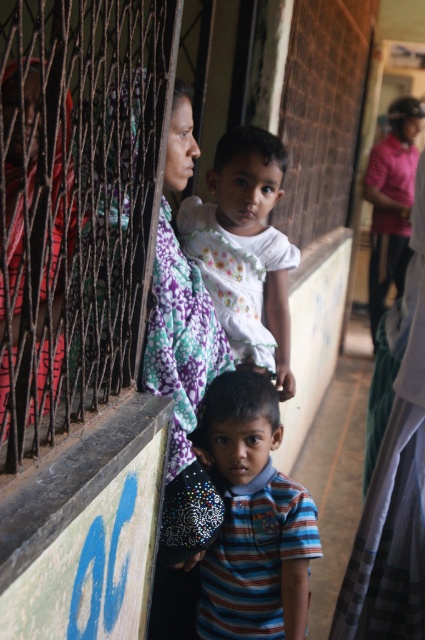
Does striped cotton shirt at center appear on the right side of white matte dress at center?

Indeed, striped cotton shirt at center is positioned on the right side of white matte dress at center.

Can you confirm if striped cotton shirt at center is positioned below white matte dress at center?

Indeed, striped cotton shirt at center is positioned under white matte dress at center.

Find the location of `striped cotton shirt at center`. striped cotton shirt at center is located at coordinates (252, 518).

You are a GUI agent. You are given a task and a screenshot of the screen. Output one action in this format:
    pyautogui.click(x=<x>, y=<y>)
    Task: Click on the striped cotton shirt at center
    Image resolution: width=425 pixels, height=640 pixels.
    Given the screenshot: What is the action you would take?
    pyautogui.click(x=252, y=518)